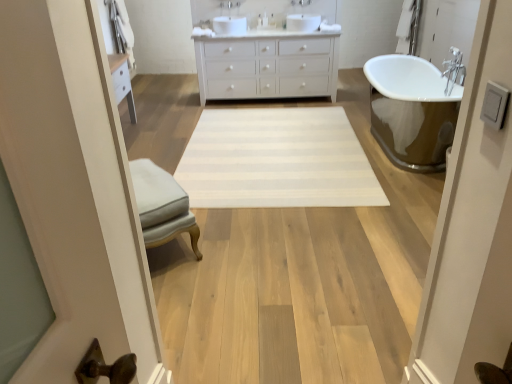
Where is `free location to the right of light gray fabric ottoman at center`? free location to the right of light gray fabric ottoman at center is located at coordinates (242, 238).